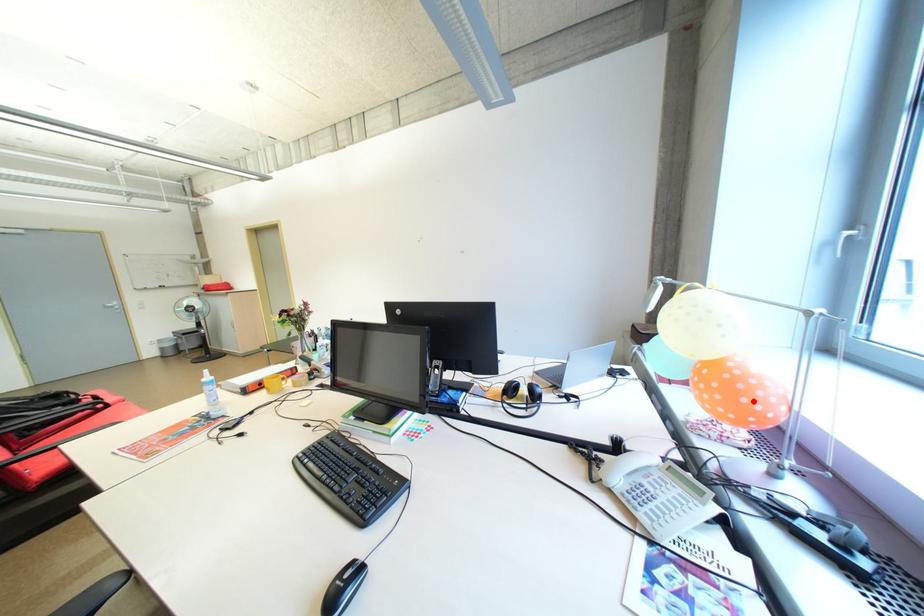
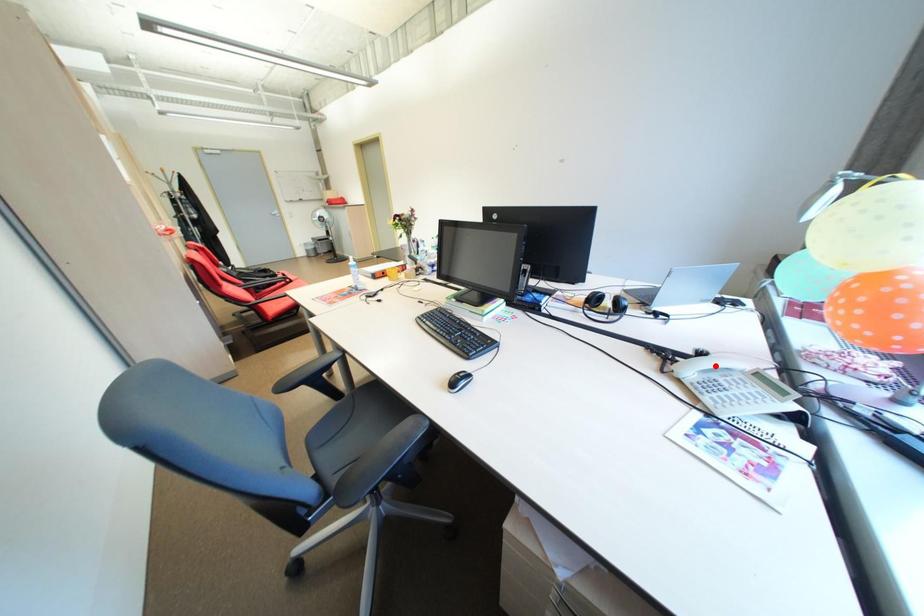
I am providing you with two images of the same scene from different viewpoints. A red point is marked on the first image and another point is marked on the second image. Does the point marked in image1 correspond to the same location as the one in image2?

No